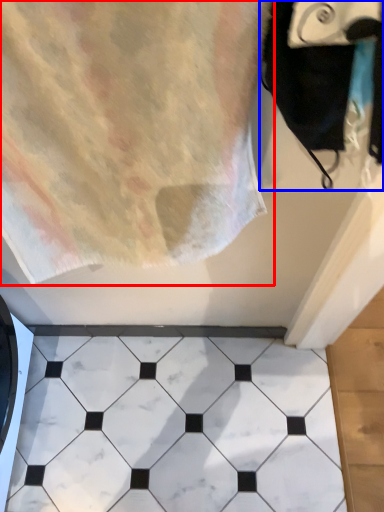
Question: Which point is further to the camera, towel (highlighted by a red box) or bath towel (highlighted by a blue box)?

Choices:
 (A) towel
 (B) bath towel

Answer: (A)